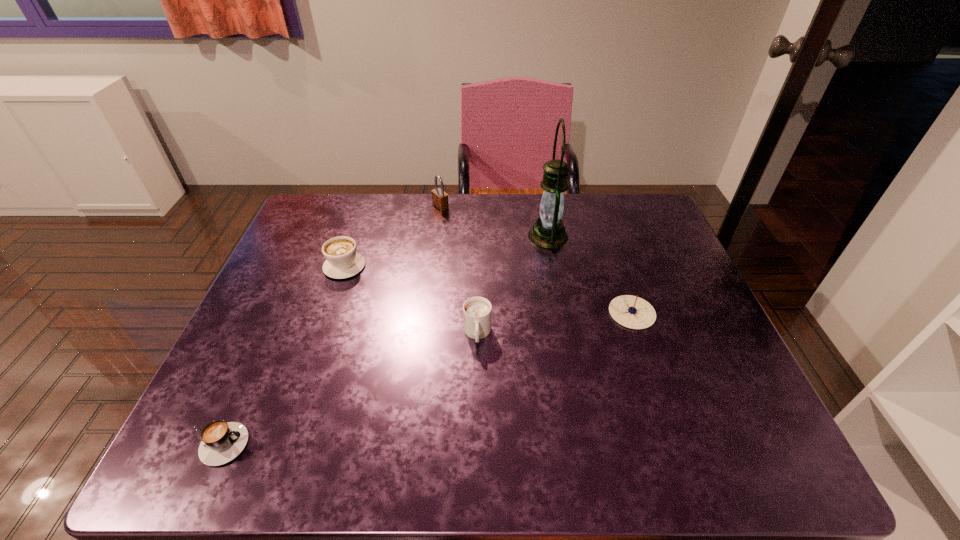
Find the location of `free space in the image that satisfies the following two spatial constraints: 1. on the side where the lantern emits light; 2. on the side with the handle of the second nearest cappuccino`. free space in the image that satisfies the following two spatial constraints: 1. on the side where the lantern emits light; 2. on the side with the handle of the second nearest cappuccino is located at coordinates (566, 334).